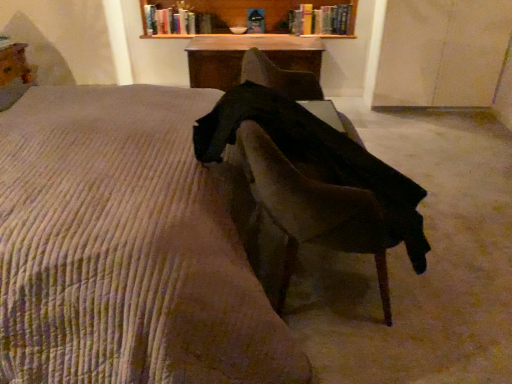
Question: Based on their positions, is corduroy bedspread at center located to the left or right of hardcover book at upper center, which is counted as the first book, starting from the left?

Choices:
 (A) left
 (B) right

Answer: (A)

Question: From the image's perspective, is corduroy bedspread at center above or below hardcover book at upper center, the 2th book viewed from the right?

Choices:
 (A) below
 (B) above

Answer: (A)

Question: Estimate the real-world distances between objects in this image. Which object is farther from the wooden table at upper center, the 1th table when ordered from left to right?

Choices:
 (A) corduroy bedspread at center
 (B) hardcover book at upper center, which is counted as the first book, starting from the left
 (C) wooden at upper center
 (D) dark fabric chair at center
 (E) wooden table at center, the first table from the right

Answer: (D)

Question: Which of these objects is positioned closest to the corduroy bedspread at center?

Choices:
 (A) wooden at upper center
 (B) hardcover book at upper center, the 2th book viewed from the right
 (C) wooden table at upper center, the 1th table when ordered from left to right
 (D) dark fabric chair at center
 (E) hardcover book at upper center, which is the second book in left-to-right order

Answer: (D)